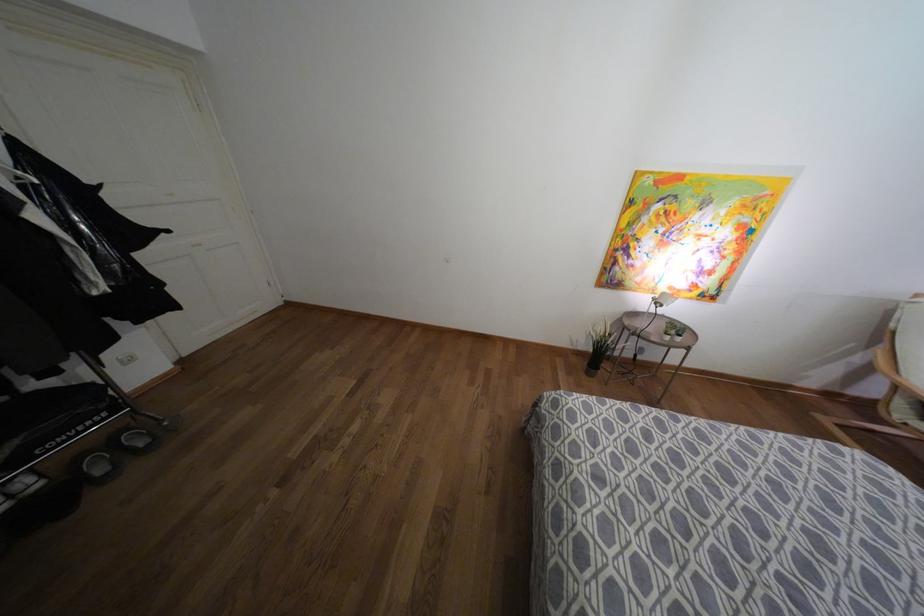
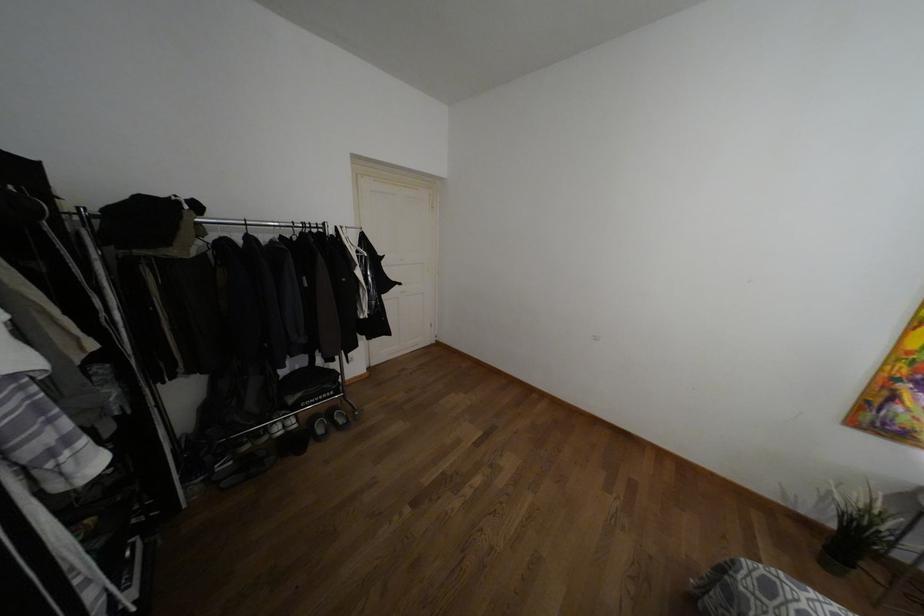
Locate, in the second image, the point that corresponds to the point at 140,442 in the first image.

(341, 419)